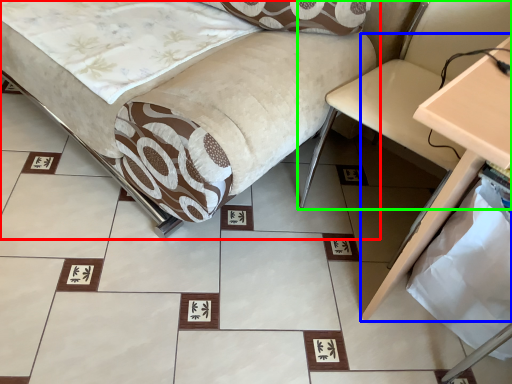
Question: Considering the real-world distances, which object is closest to furniture (highlighted by a red box)? table (highlighted by a blue box) or swivel chair (highlighted by a green box).

Choices:
 (A) table
 (B) swivel chair

Answer: (B)